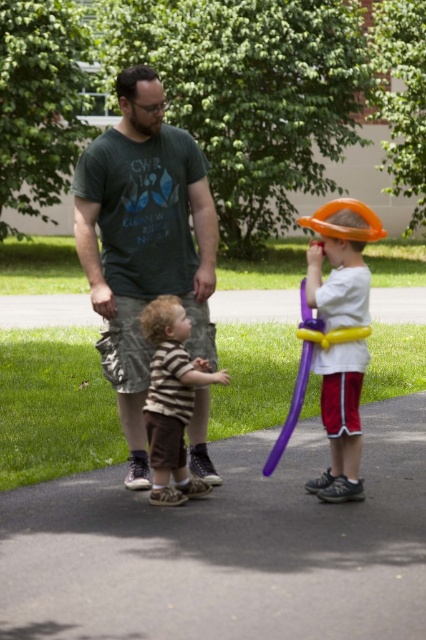
Is striped cotton shirt at center closer to the viewer compared to smooth concrete path at center?

Yes.

Does point (186, 356) lie in front of point (71, 324)?

Yes, it is.

What are the coordinates of `striped cotton shirt at center` in the screenshot? It's located at (172, 400).

Does smooth asphalt pavement at center lie in front of dark green t-shirt at center?

Yes, it is in front of dark green t-shirt at center.

This screenshot has height=640, width=426. Identify the location of smooth asphalt pavement at center. (227, 547).

Is point (181, 179) positioned in front of point (282, 435)?

No, (181, 179) is further to viewer.

What do you see at coordinates (143, 243) in the screenshot? I see `dark green t-shirt at center` at bounding box center [143, 243].

You are a GUI agent. You are given a task and a screenshot of the screen. Output one action in this format:
    pyautogui.click(x=<x>, y=<y>)
    Task: Click on the dark green t-shirt at center
    
    Given the screenshot: What is the action you would take?
    (143, 243)